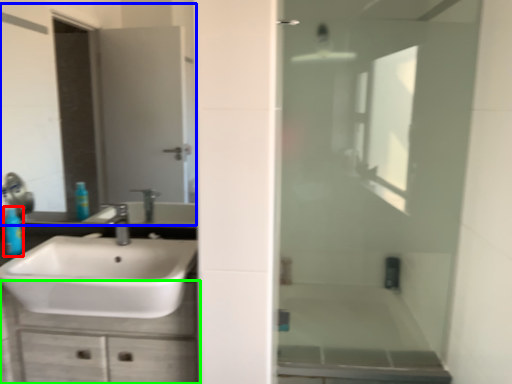
Question: Based on their relative distances, which object is nearer to toiletry (highlighted by a red box)? Choose from mirror (highlighted by a blue box) and bathroom cabinet (highlighted by a green box).

Choices:
 (A) mirror
 (B) bathroom cabinet

Answer: (B)